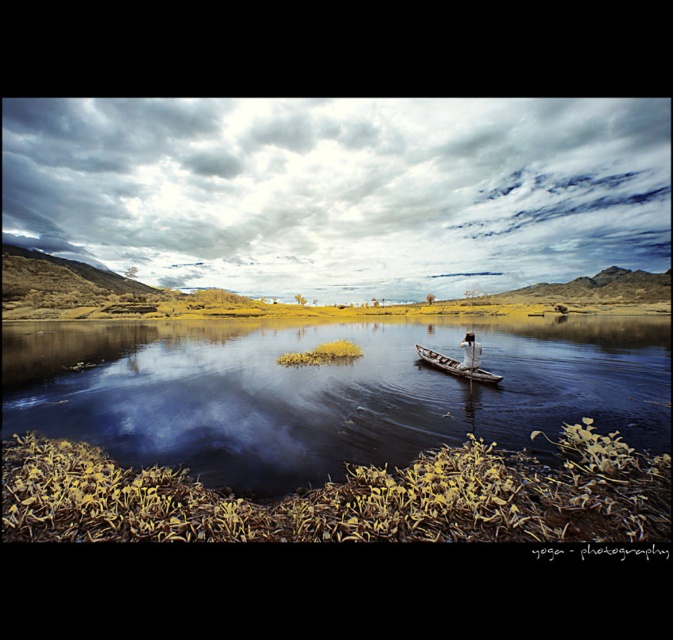
Is the position of smooth dark water at center more distant than that of white fabric boat at center?

No, smooth dark water at center is closer to the viewer.

Locate an element on the screen. The height and width of the screenshot is (640, 673). smooth dark water at center is located at coordinates (324, 392).

Does smooth dark water at center come in front of wooden canoe at center?

Yes, it is.

Is smooth dark water at center smaller than wooden canoe at center?

Incorrect, smooth dark water at center is not smaller in size than wooden canoe at center.

Does point (240, 438) come farther from viewer compared to point (427, 355)?

That is False.

Identify the location of smooth dark water at center. (324, 392).

Does wooden canoe at center lie behind white fabric boat at center?

No.

Is point (435, 356) in front of point (470, 337)?

No, (435, 356) is behind (470, 337).

This screenshot has height=640, width=673. I want to click on wooden canoe at center, so click(x=456, y=365).